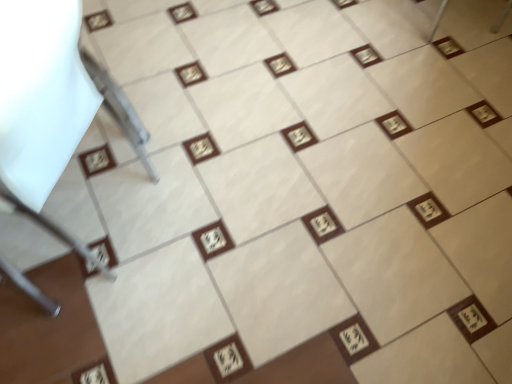
What do you see at coordinates (41, 104) in the screenshot? I see `white plastic chair at left` at bounding box center [41, 104].

Identify the location of white plastic chair at left. The height and width of the screenshot is (384, 512). (41, 104).

Identify the location of white plastic chair at left. (41, 104).